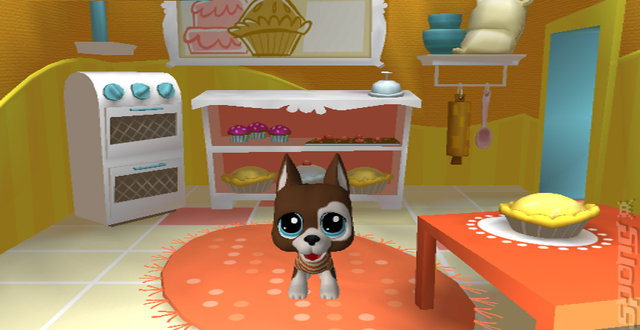
At what (x,y) coordinates should I click in order to perform the action: click on orange table top surface. Please return your answer as a coordinate pair (x, y). Looking at the image, I should click on (543, 274).